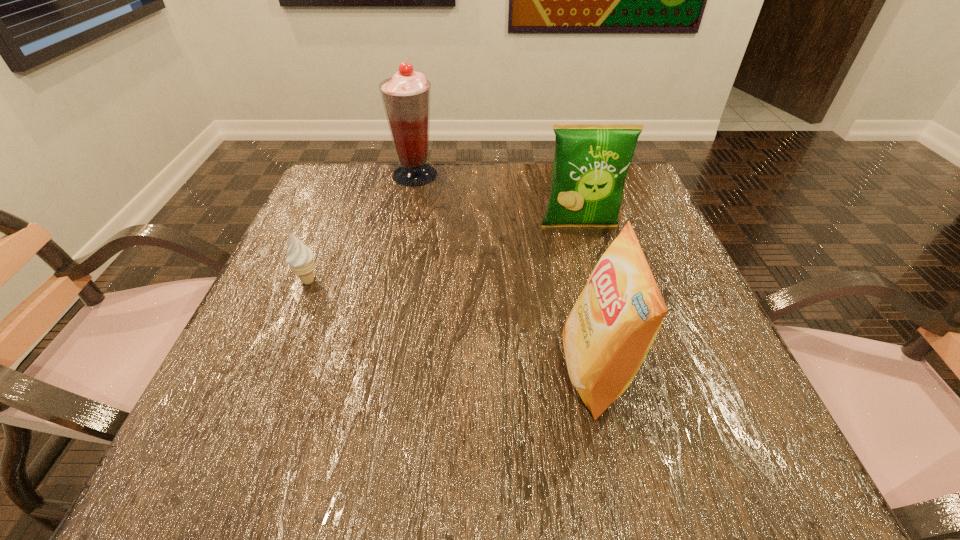
I want to click on empty space between the second farthest object and the second object from left to right, so click(x=497, y=201).

The height and width of the screenshot is (540, 960). In order to click on vacant space that's between the farther crisp (potato chip) and the leftmost object in this screenshot , I will do `click(444, 254)`.

You are a GUI agent. You are given a task and a screenshot of the screen. Output one action in this format:
    pyautogui.click(x=<x>, y=<y>)
    Task: Click on the object that is the closest to the second farthest object
    The width and height of the screenshot is (960, 540).
    Given the screenshot: What is the action you would take?
    pyautogui.click(x=608, y=333)

Identify which object is located as the nearest to the second farthest object. Please provide its 2D coordinates. Your answer should be formatted as a tuple, i.e. [(x, y)], where the tuple contains the x and y coordinates of a point satisfying the conditions above.

[(608, 333)]

The height and width of the screenshot is (540, 960). What are the coordinates of `free space that satisfies the following two spatial constraints: 1. on the front-facing side of the second farthest object; 2. on the front-facing side of the nearer crisp (potato chip)` in the screenshot? It's located at (619, 372).

This screenshot has width=960, height=540. In order to click on free space that satisfies the following two spatial constraints: 1. on the front-facing side of the farther crisp (potato chip); 2. on the front-facing side of the nearer crisp (potato chip) in this screenshot , I will do `click(619, 372)`.